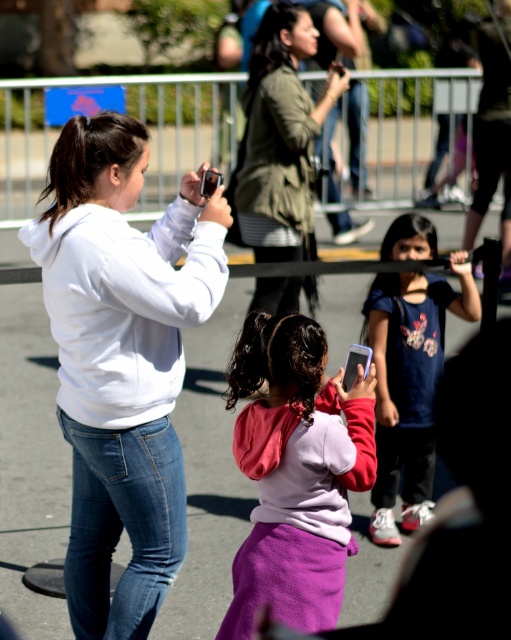
Question: Which of these objects is positioned farthest from the white matte hoodie at upper left?

Choices:
 (A) blue denim jeans at center
 (B) pink fleece hoodie at center
 (C) green matte jacket at center

Answer: (C)

Question: Does blue denim jeans at center appear under dark blue fabric shirt at center?

Choices:
 (A) no
 (B) yes

Answer: (B)

Question: Which point is farther to the camera?

Choices:
 (A) pink fleece hoodie at center
 (B) blue denim jeans at center
 (C) green matte jacket at center
 (D) white matte hoodie at upper left

Answer: (C)

Question: Which of the following is the closest to the observer?

Choices:
 (A) blue denim jeans at center
 (B) green matte jacket at center

Answer: (A)

Question: Is white matte hoodie at upper left wider than blue denim jeans at center?

Choices:
 (A) yes
 (B) no

Answer: (A)

Question: Considering the relative positions of white matte hoodie at upper left and blue denim jeans at center in the image provided, where is white matte hoodie at upper left located with respect to blue denim jeans at center?

Choices:
 (A) left
 (B) right

Answer: (B)